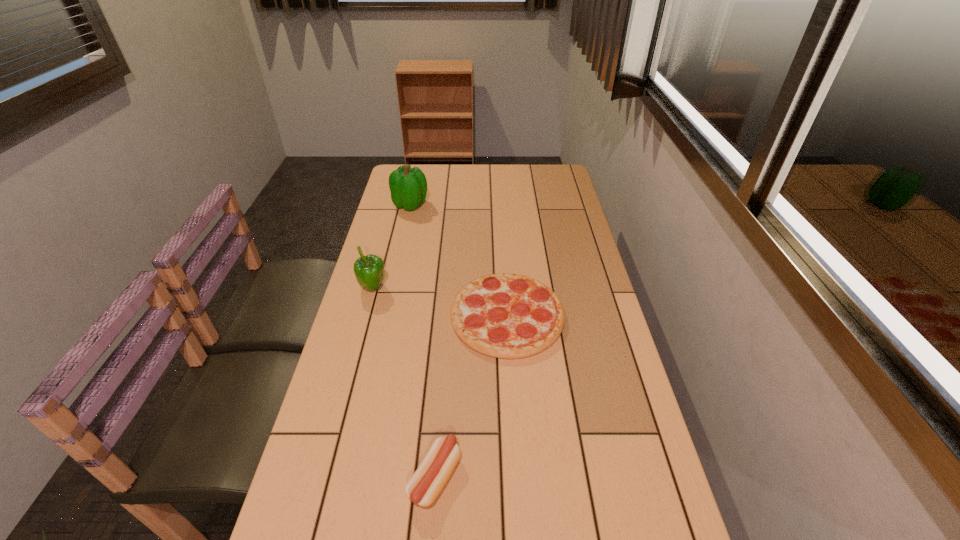
This screenshot has height=540, width=960. What are the coordinates of `the farther bell pepper` in the screenshot? It's located at (408, 186).

This screenshot has height=540, width=960. Find the location of `the nearer bell pepper`. the nearer bell pepper is located at coordinates (369, 270).

You are a GUI agent. You are given a task and a screenshot of the screen. Output one action in this format:
    pyautogui.click(x=<x>, y=<y>)
    Task: Click on the sausage
    
    Given the screenshot: What is the action you would take?
    pyautogui.click(x=427, y=482)

Locate an element on the screen. The height and width of the screenshot is (540, 960). the nearest object is located at coordinates (427, 482).

Find the location of a particular element. This screenshot has height=540, width=960. the shortest object is located at coordinates (509, 316).

Where is `vacant space situated on the front of the farther bell pepper`? The height and width of the screenshot is (540, 960). vacant space situated on the front of the farther bell pepper is located at coordinates (399, 253).

Identify the location of vacant space situated on the front of the nearer bell pepper. (360, 335).

Where is `vacant space positioned on the back of the nearest object`? The width and height of the screenshot is (960, 540). vacant space positioned on the back of the nearest object is located at coordinates (441, 406).

Find the location of `vacant space located on the back of the shortest object`. vacant space located on the back of the shortest object is located at coordinates 500,214.

Find the location of a particular element. The image size is (960, 540). object that is at the right edge is located at coordinates (509, 316).